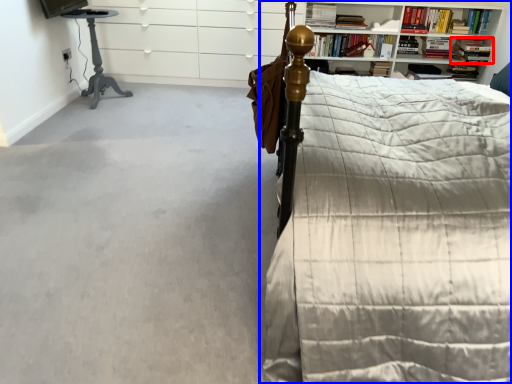
Question: Which object appears closest to the camera in this image, book (highlighted by a red box) or bed (highlighted by a blue box)?

Choices:
 (A) book
 (B) bed

Answer: (B)